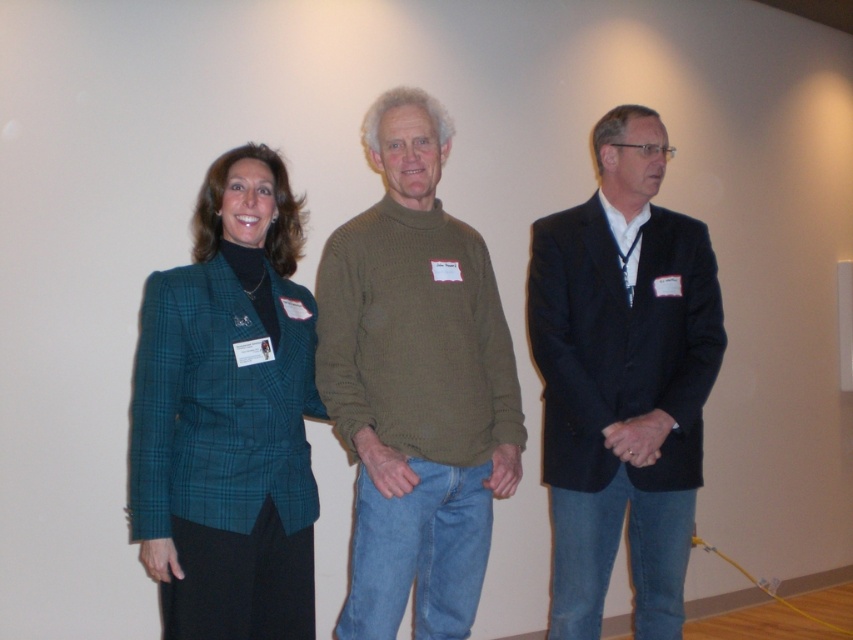
You are a photographer setting up for a group photo. You notice the teal plaid blazer at center and the dark blue suit at center. Which one is positioned to the left?

The teal plaid blazer at center is to the left of the dark blue suit at center.

From the picture: You are a photographer setting up for a group photo. You need to ensure that the knit green sweater at center and the dark blue suit at center are both visible in the frame. Based on their positions, which one is covering part of the other?

The knit green sweater at center is positioned over the dark blue suit at center, so it is covering part of it.

You are a photographer setting up for a group photo. You need to ensure that the distance between the knit green sweater at center and the teal plaid blazer at center is at least 12 inches to avoid overcrowding. Based on the scene description, is the current spacing sufficient?

The distance between the knit green sweater at center and the teal plaid blazer at center is 10.13 inches, which is less than the required 12 inches. Therefore, the current spacing is insufficient to avoid overcrowding.